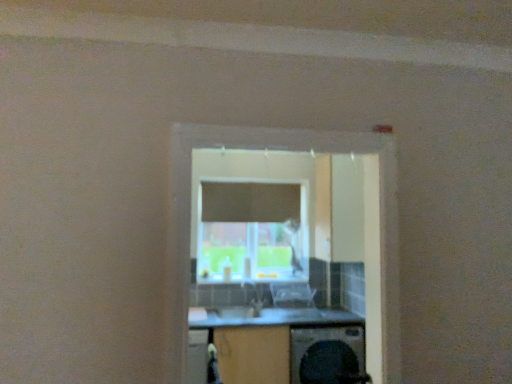
Question: Considering the relative sizes of wooden at center and transparent glass window at center in the image provided, is wooden at center thinner than transparent glass window at center?

Choices:
 (A) no
 (B) yes

Answer: (A)

Question: Can you confirm if wooden at center is bigger than transparent glass window at center?

Choices:
 (A) yes
 (B) no

Answer: (A)

Question: Are wooden at center and transparent glass window at center located far from each other?

Choices:
 (A) no
 (B) yes

Answer: (B)

Question: Is wooden at center positioned before transparent glass window at center?

Choices:
 (A) yes
 (B) no

Answer: (B)

Question: From the image's perspective, is wooden at center over transparent glass window at center?

Choices:
 (A) yes
 (B) no

Answer: (B)

Question: Considering the positions of transparent glass window at center and black plastic washing machine at lower center in the image, is transparent glass window at center taller or shorter than black plastic washing machine at lower center?

Choices:
 (A) short
 (B) tall

Answer: (B)

Question: Looking at their shapes, would you say transparent glass window at center is wider or thinner than black plastic washing machine at lower center?

Choices:
 (A) wide
 (B) thin

Answer: (B)

Question: Based on their sizes in the image, would you say transparent glass window at center is bigger or smaller than black plastic washing machine at lower center?

Choices:
 (A) big
 (B) small

Answer: (B)

Question: From a real-world perspective, is transparent glass window at center positioned above or below black plastic washing machine at lower center?

Choices:
 (A) above
 (B) below

Answer: (A)

Question: Based on their sizes in the image, would you say wooden at center is bigger or smaller than clear plastic chair at center?

Choices:
 (A) big
 (B) small

Answer: (A)

Question: Considering the positions of wooden at center and clear plastic chair at center in the image, is wooden at center wider or thinner than clear plastic chair at center?

Choices:
 (A) wide
 (B) thin

Answer: (A)

Question: Is point [x=332, y=317] closer or farther from the camera than point [x=294, y=314]?

Choices:
 (A) farther
 (B) closer

Answer: (B)

Question: Relative to clear plastic chair at center, is wooden at center in front or behind?

Choices:
 (A) behind
 (B) front

Answer: (B)

Question: From the image's perspective, is transparent glass window at center above or below clear plastic chair at center?

Choices:
 (A) below
 (B) above

Answer: (B)

Question: From a real-world perspective, is transparent glass window at center positioned above or below clear plastic chair at center?

Choices:
 (A) above
 (B) below

Answer: (A)